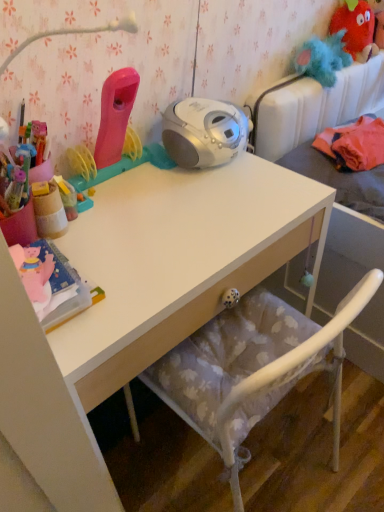
What are the coordinates of `free point to the right of wooden pencil case at left` in the screenshot? It's located at (132, 227).